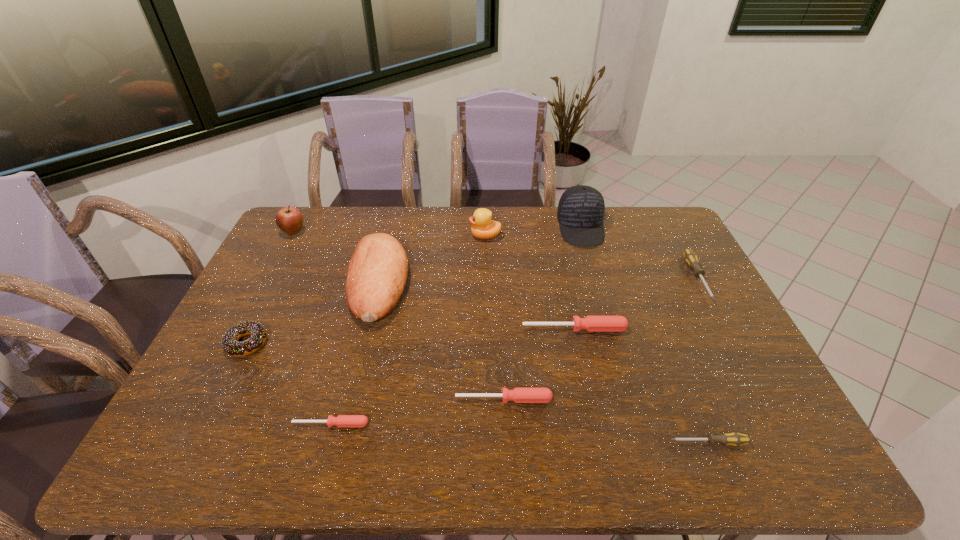
Locate an element on the screen. The image size is (960, 540). free space at the left edge of the desktop is located at coordinates (304, 253).

The image size is (960, 540). What are the coordinates of `free region at the right edge of the desktop` in the screenshot? It's located at (709, 329).

Identify the location of vacant region at the far left corner of the desktop. The width and height of the screenshot is (960, 540). (304, 213).

This screenshot has width=960, height=540. I want to click on vacant space that is in between the red apple and the baseball cap, so click(x=437, y=230).

I want to click on free space between the doughnut and the farthest red screwdriver, so click(411, 336).

Locate an element on the screen. This screenshot has height=540, width=960. free space between the nearest red screwdriver and the farthest red screwdriver is located at coordinates (453, 376).

The image size is (960, 540). I want to click on vacant area that lies between the apple and the nearer gray screwdriver, so click(501, 338).

Identify the location of vacant space that is in between the chocolate doughnut and the fourth nearest screwdriver. The image size is (960, 540). (411, 336).

This screenshot has width=960, height=540. What are the coordinates of `free space between the right gray screwdriver and the yellow duckling` in the screenshot? It's located at 591,257.

The height and width of the screenshot is (540, 960). Find the location of `blank region between the chocolate doughnut and the red apple`. blank region between the chocolate doughnut and the red apple is located at coordinates (271, 288).